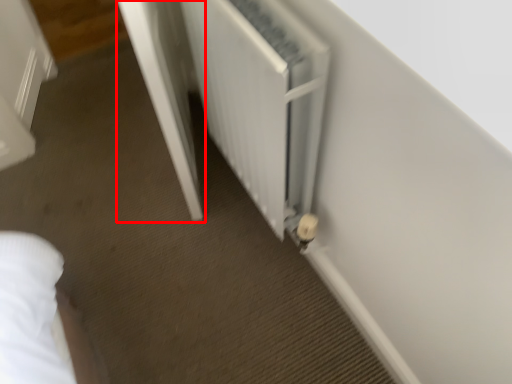
Question: From the image, what is the correct spatial relationship of screen door (annotated by the red box) in relation to radiator?

Choices:
 (A) left
 (B) right

Answer: (A)